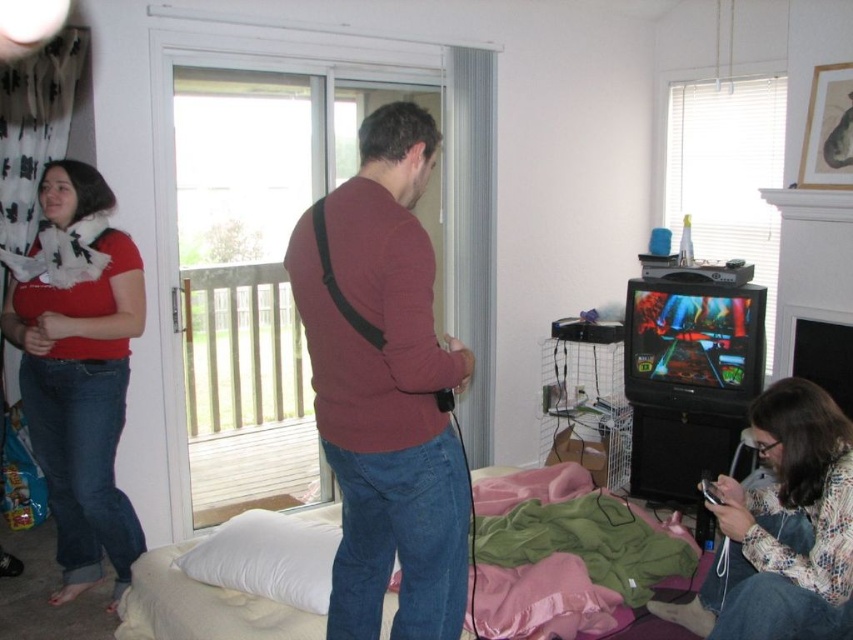
Question: Estimate the real-world distances between objects in this image. Which object is farther from the maroon sweater at center?

Choices:
 (A) matte red sweater at left
 (B) floral print sweater at lower right

Answer: (A)

Question: Considering the real-world distances, which object is farthest from the floral print sweater at lower right?

Choices:
 (A) maroon sweater at center
 (B) matte red sweater at left

Answer: (B)

Question: Is matte red sweater at left to the left of floral print sweater at lower right from the viewer's perspective?

Choices:
 (A) yes
 (B) no

Answer: (A)

Question: Estimate the real-world distances between objects in this image. Which object is farther from the matte red sweater at left?

Choices:
 (A) floral print sweater at lower right
 (B) maroon sweater at center

Answer: (A)

Question: In this image, where is maroon sweater at center located relative to matte red sweater at left?

Choices:
 (A) right
 (B) left

Answer: (A)

Question: Does maroon sweater at center appear over floral print sweater at lower right?

Choices:
 (A) no
 (B) yes

Answer: (B)